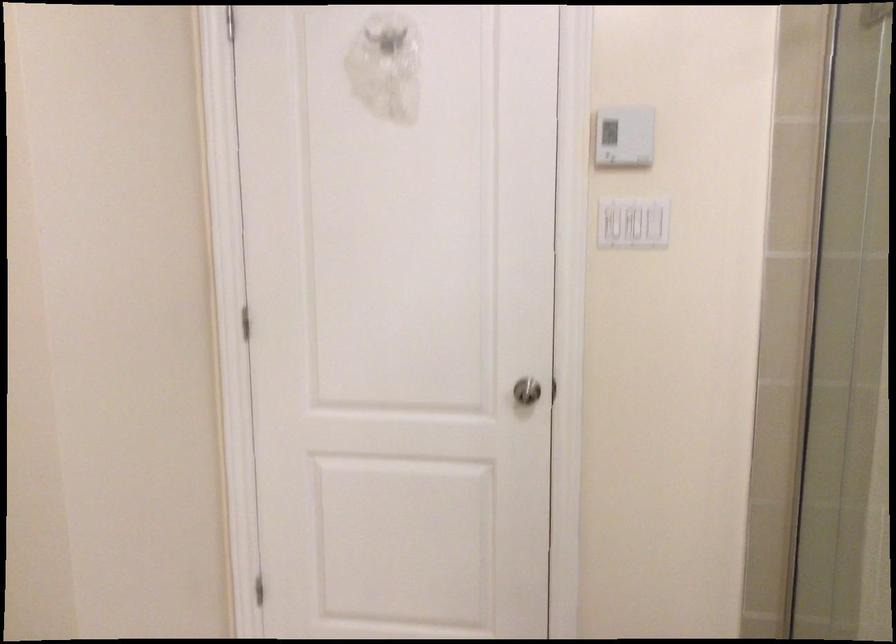
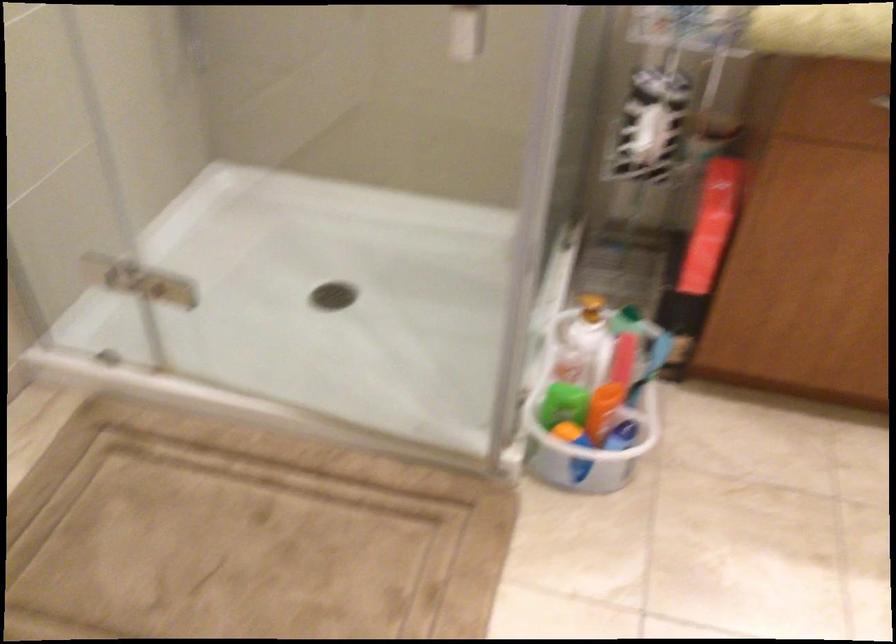
Based on the photo, based on the continuous images, in which direction is the camera rotating?

The camera's rotation is toward right-down.